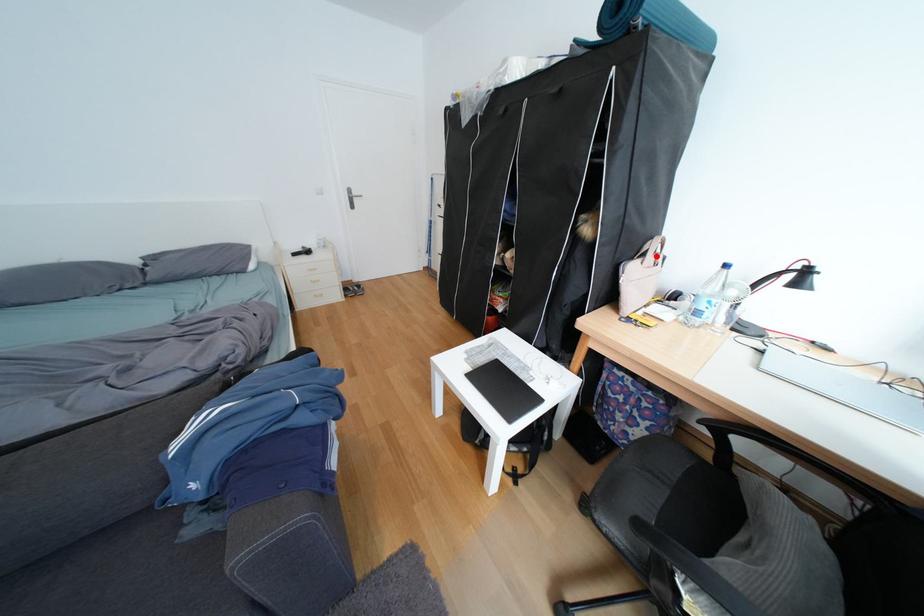
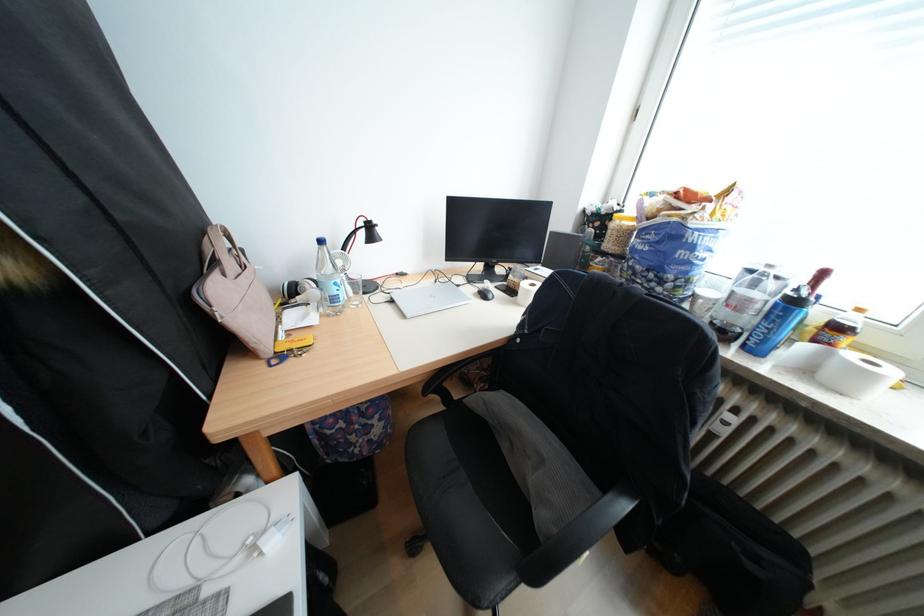
In the second image, find the point that corresponds to the highlighted location in the first image.

(227, 264)